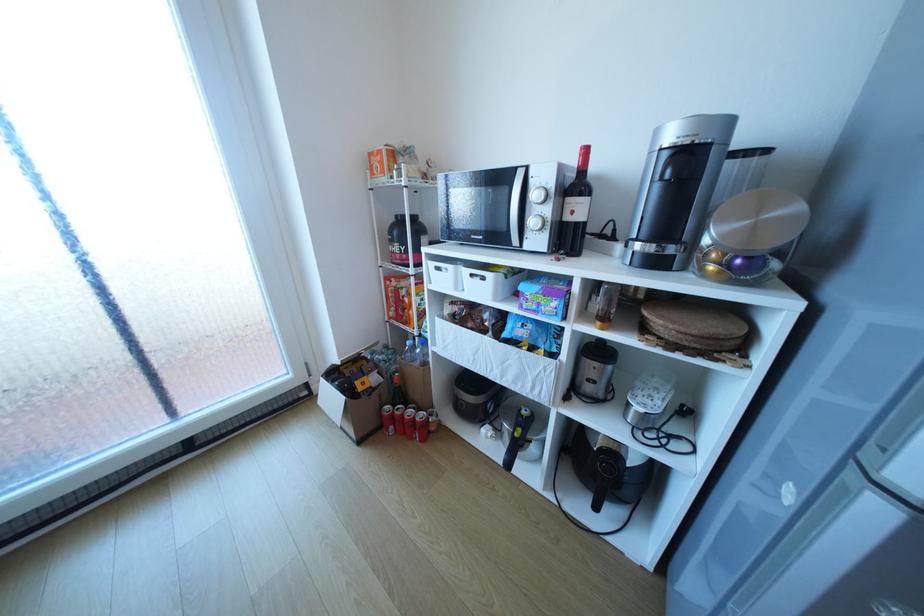
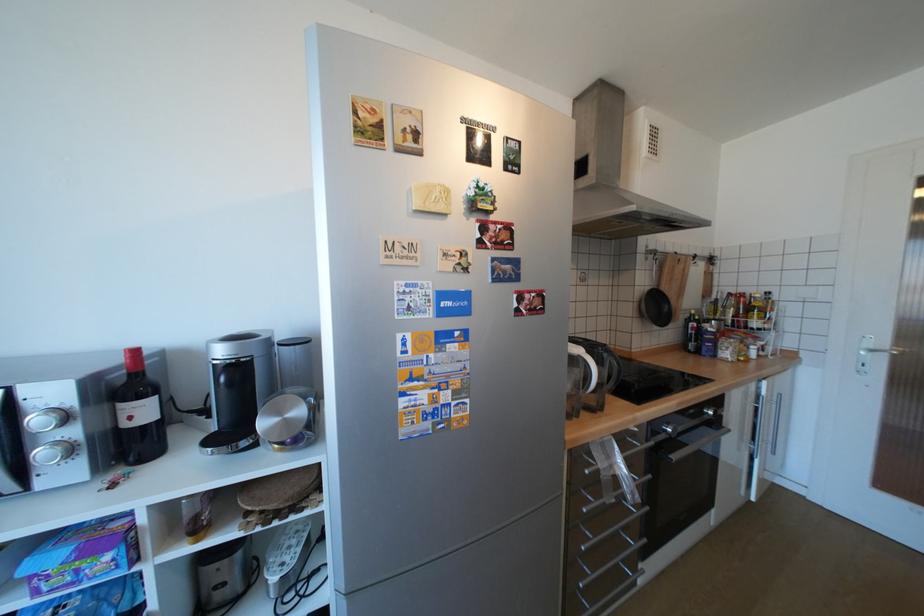
Locate, in the second image, the point that corresponds to point 543,307 in the first image.

(79, 578)